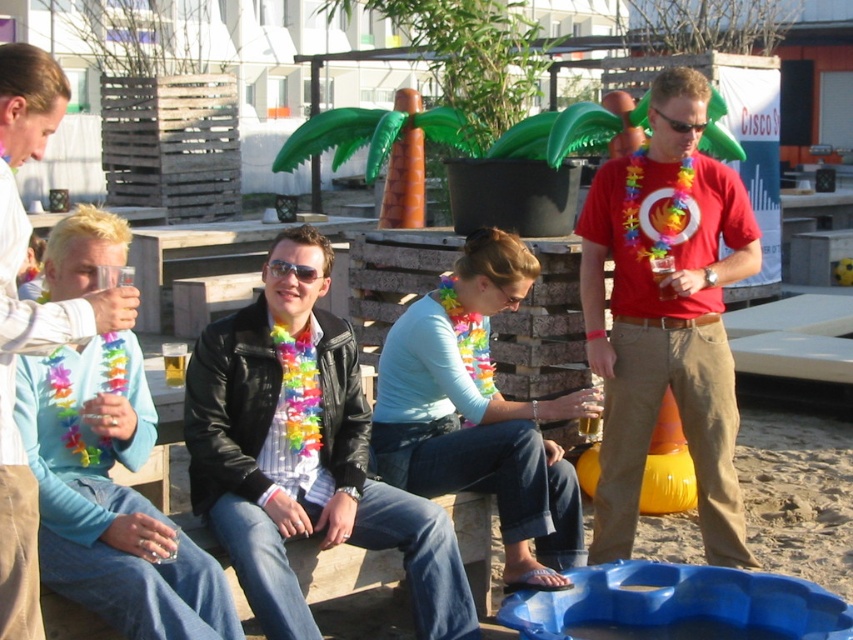
Question: Among these objects, which one is nearest to the camera?

Choices:
 (A) matte black jacket at left
 (B) black plastic goggles at center
 (C) red matte t-shirt at center

Answer: (A)

Question: Does black plastic goggles at center appear on the right side of sunglasses at center?

Choices:
 (A) yes
 (B) no

Answer: (A)

Question: Is leather jacket at center further to the viewer compared to translucent glass at lower left?

Choices:
 (A) no
 (B) yes

Answer: (A)

Question: Can you confirm if leather jacket at center is positioned above sunglasses at center?

Choices:
 (A) yes
 (B) no

Answer: (B)

Question: Which object is the closest to the translucent glass at lower left?

Choices:
 (A) red matte t-shirt at center
 (B) black plastic goggles at center

Answer: (A)

Question: Estimate the real-world distances between objects in this image. Which object is closer to the leather jacket at center?

Choices:
 (A) black plastic goggles at center
 (B) translucent glass beer at center
 (C) light blue sweater at left

Answer: (C)